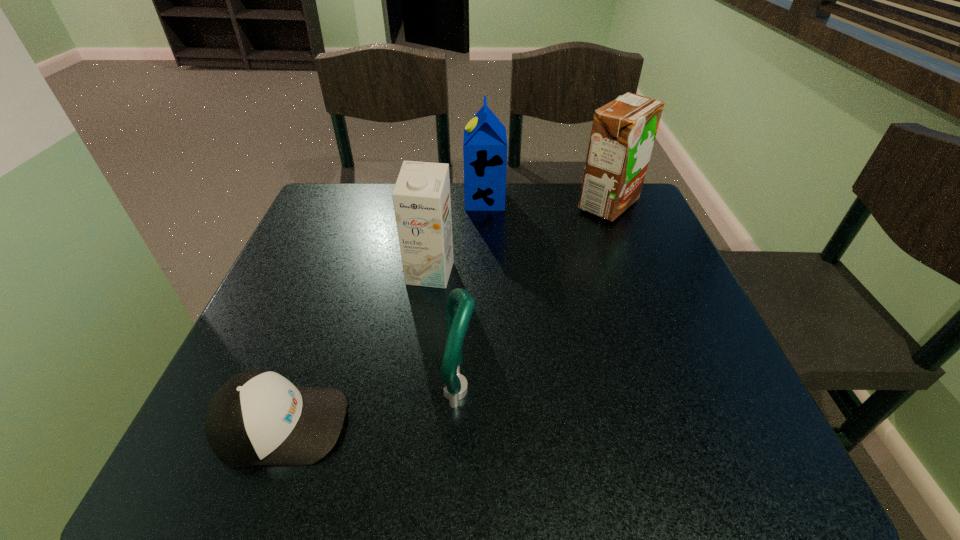
At what (x,y) coordinates should I click in order to perform the action: click on the closest object to the rightmost carton. Please return your answer as a coordinate pair (x, y). This screenshot has width=960, height=540. Looking at the image, I should click on [x=485, y=146].

Find the location of a particular element. This screenshot has height=540, width=960. the second closest carton to the rightmost carton is located at coordinates (421, 197).

Locate an element on the screen. The height and width of the screenshot is (540, 960). the closest carton relative to the rightmost object is located at coordinates (485, 146).

This screenshot has width=960, height=540. Identify the location of free spot that satisfies the following two spatial constraints: 1. with the cap open on the second carton from left to right; 2. on the front side of the nearest carton. (486, 273).